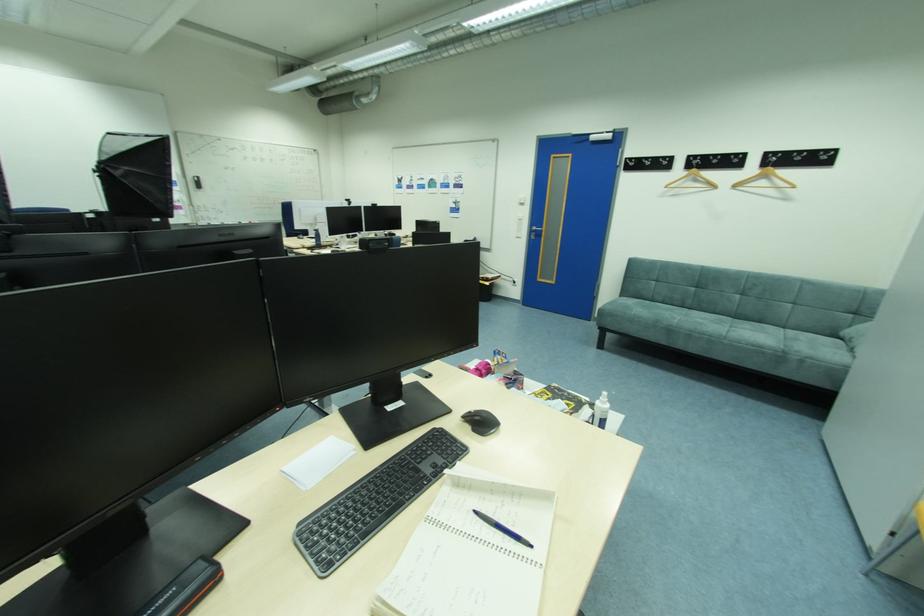
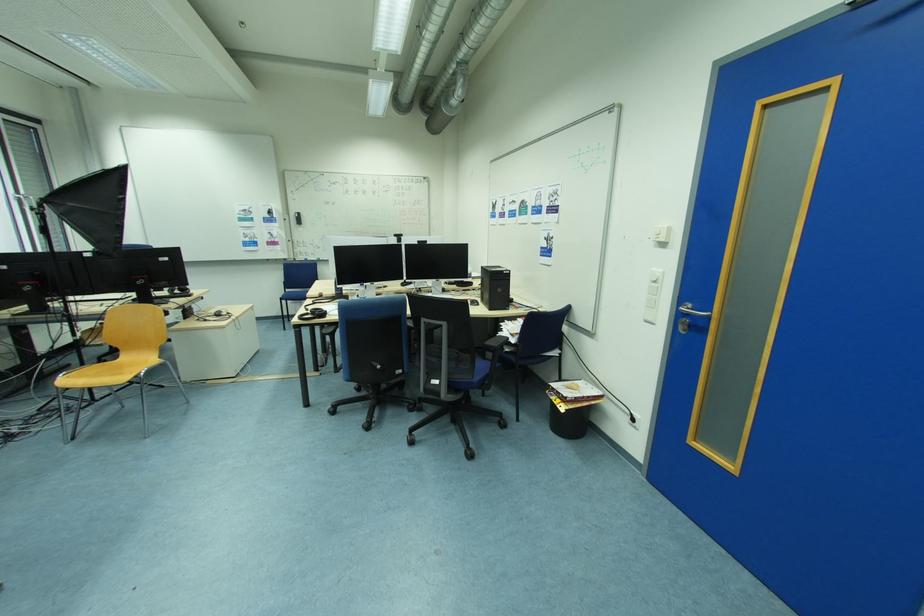
In the second image, find the point that corresponds to point (494, 285) in the first image.

(569, 408)